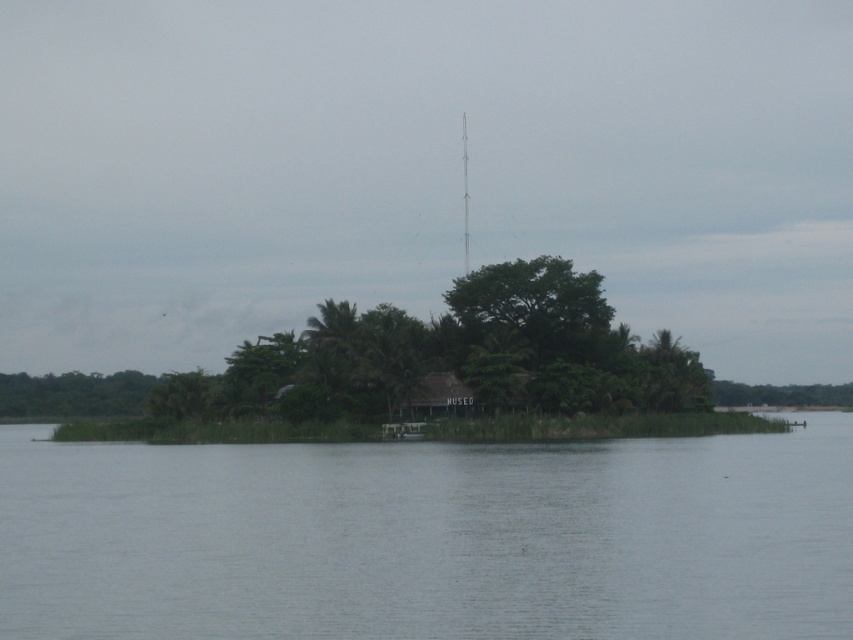
Between clear water at center and brown thatched hut at center, which one appears on the left side from the viewer's perspective?

clear water at center is more to the left.

Between clear water at center and brown thatched hut at center, which one has more height?

Standing taller between the two is clear water at center.

Which is behind, point (834, 444) or point (438, 378)?

Point (438, 378)

The height and width of the screenshot is (640, 853). In order to click on clear water at center in this screenshot , I will do `click(428, 538)`.

Can you confirm if green leafy tree at center is positioned below brown thatched hut at center?

Actually, green leafy tree at center is above brown thatched hut at center.

Can you confirm if green leafy tree at center is wider than brown thatched hut at center?

Yes.

Find the location of a particular element. green leafy tree at center is located at coordinates (534, 307).

The image size is (853, 640). In order to click on green leafy tree at center in this screenshot , I will do `click(534, 307)`.

What do you see at coordinates (428, 538) in the screenshot? I see `clear water at center` at bounding box center [428, 538].

Who is lower down, clear water at center or green leafy tree at center?

Positioned lower is clear water at center.

Between point (703, 560) and point (538, 291), which one is positioned behind?

The point (538, 291) is behind.

This screenshot has height=640, width=853. What are the coordinates of `clear water at center` in the screenshot? It's located at (428, 538).